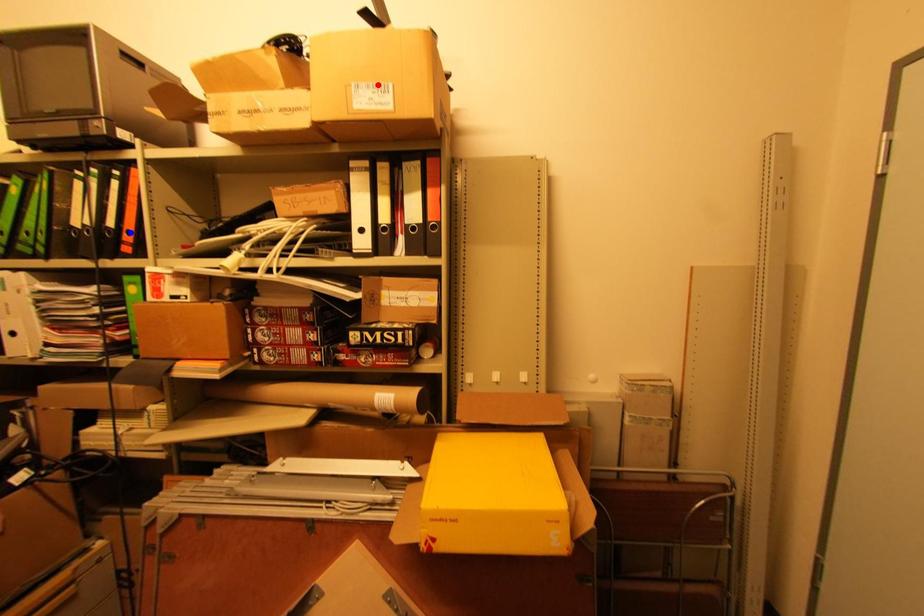
Question: Which of the two points in the image is closer to the camera?

Choices:
 (A) Blue point is closer.
 (B) Red point is closer.

Answer: (B)